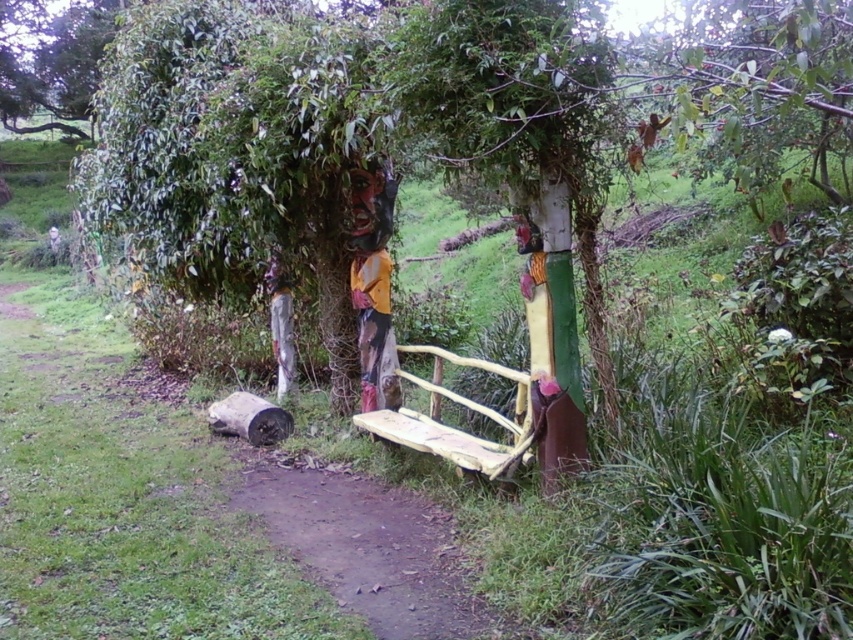
Question: Can you confirm if dirt path at center is thinner than yellow painted wood bench at center?

Choices:
 (A) no
 (B) yes

Answer: (A)

Question: Which of the following is the farthest from the observer?

Choices:
 (A) dirt path at center
 (B) yellow painted wood bench at center

Answer: (B)

Question: Is dirt path at center positioned behind yellow painted wood bench at center?

Choices:
 (A) no
 (B) yes

Answer: (A)

Question: Is dirt path at center further to camera compared to yellow painted wood bench at center?

Choices:
 (A) no
 (B) yes

Answer: (A)

Question: Which point is farther to the camera?

Choices:
 (A) (543, 349)
 (B) (352, 476)

Answer: (B)